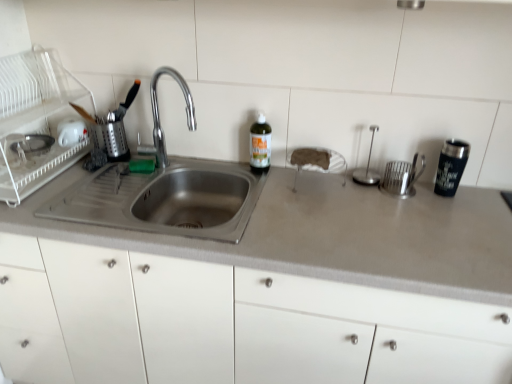
Question: Is white plastic dish rack at left, the 1th appliance from the left, taller or shorter than white glossy mug at upper left, placed as the 4th appliance when sorted from right to left?

Choices:
 (A) tall
 (B) short

Answer: (A)

Question: Which is correct: white plastic dish rack at left, positioned as the 5th appliance in right-to-left order, is inside white glossy mug at upper left, placed as the 4th appliance when sorted from right to left, or outside of it?

Choices:
 (A) inside
 (B) outside

Answer: (B)

Question: Based on their relative distances, which object is nearer to the silver metallic utensil holder at right, which is the 5th appliance from left to right?

Choices:
 (A) green glass bottle at center
 (B) white glossy mug at upper left, placed as the 4th appliance when sorted from right to left
 (C) stainless steel sink at left
 (D) black stainless steel tumbler at right
 (E) polished stainless steel spoon holder at right, positioned as the second appliance in right-to-left order

Answer: (E)

Question: Which is nearer to the black stainless steel tumbler at right?

Choices:
 (A) silver metallic utensil holder at right, positioned as the first appliance in right-to-left order
 (B) gray matte countertop at center
 (C) green glass bottle at center
 (D) stainless steel sink at left
 (E) polished stainless steel spoon holder at right, which is counted as the 4th appliance, starting from the left

Answer: (A)